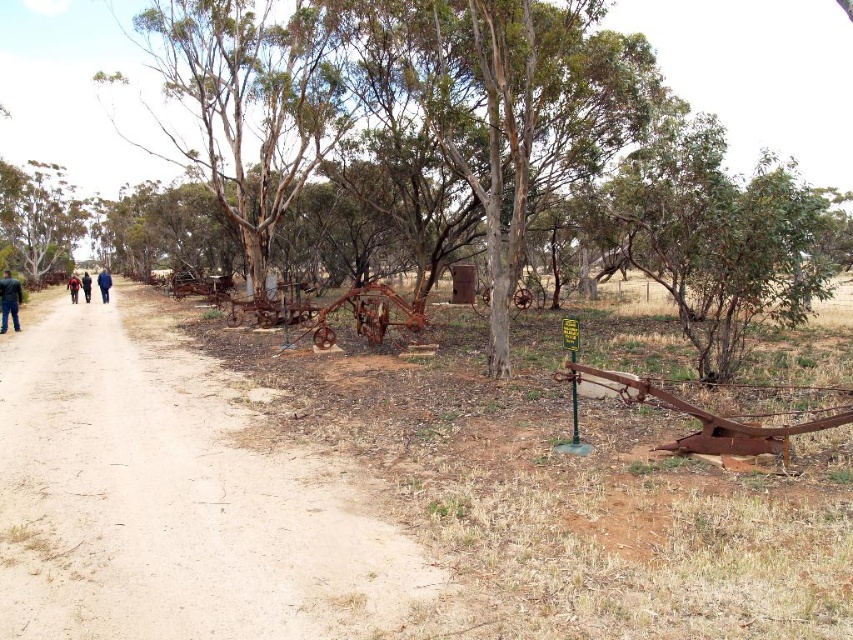
You are standing on the dirt path and want to take a photo of both the green rough bark tree at upper left and the blue jeans at left. Which object should you zoom in on first to ensure both are in frame?

You should zoom in on the green rough bark tree at upper left first because it is wider than the blue jeans at left, so adjusting for its size will help both fit in the frame.